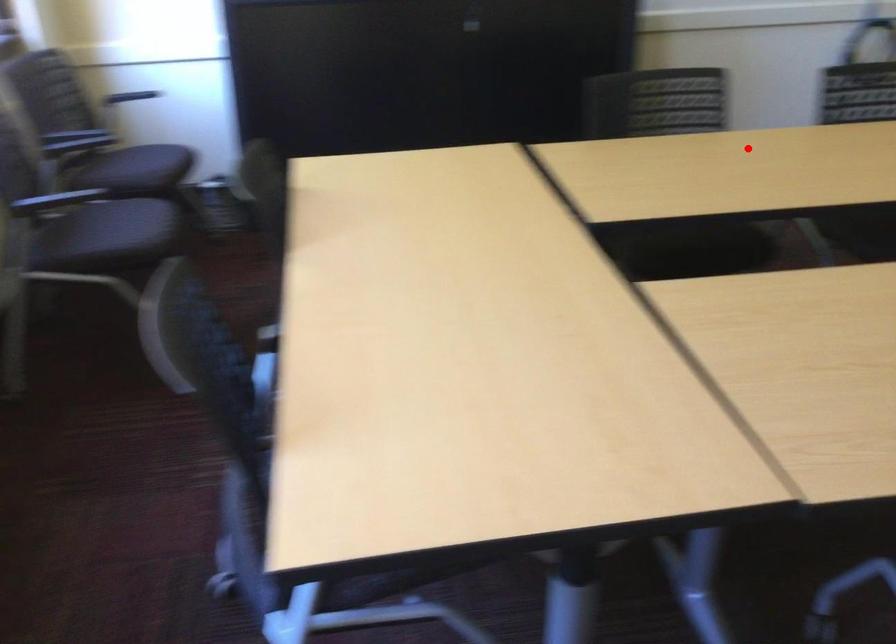
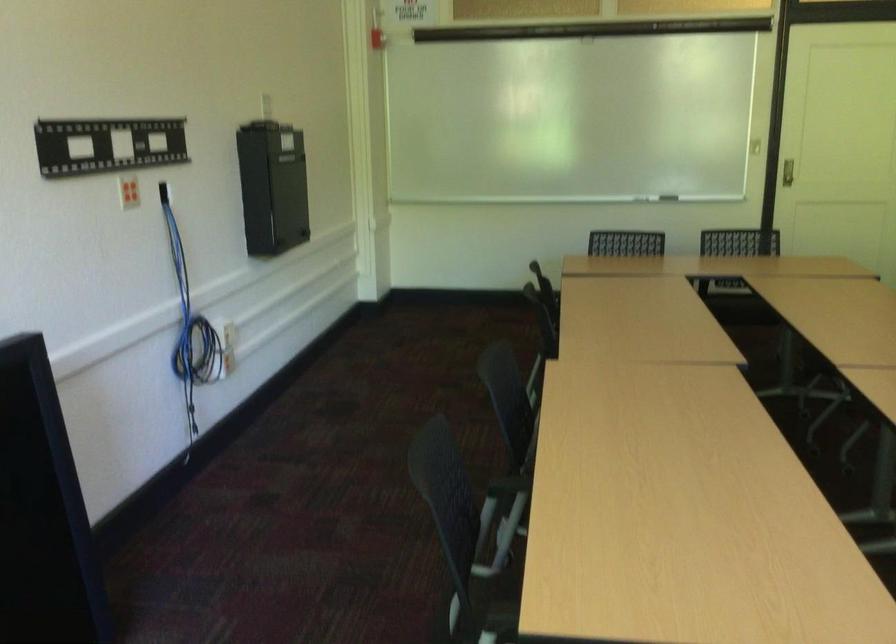
In the second image, find the point that corresponds to the highlighted location in the first image.

(506, 486)